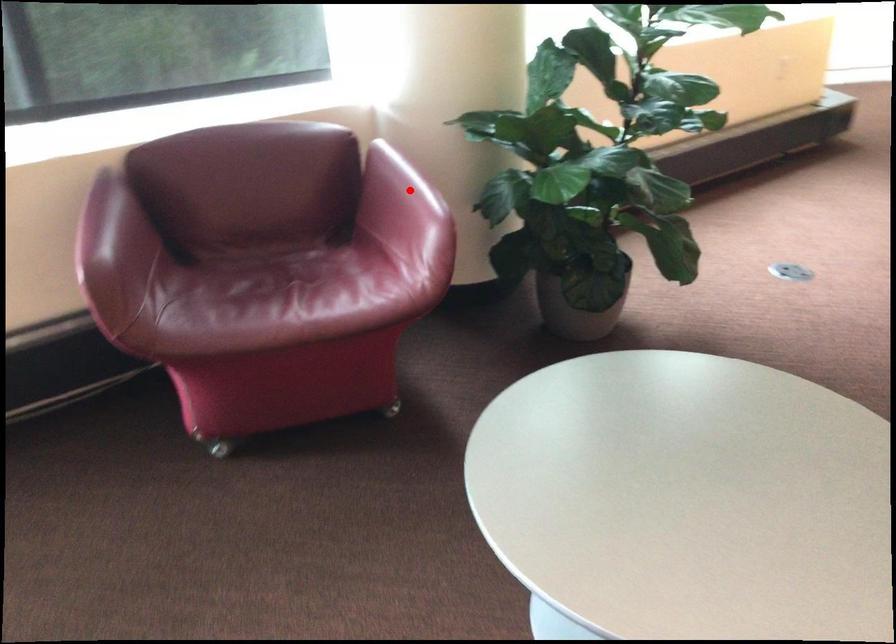
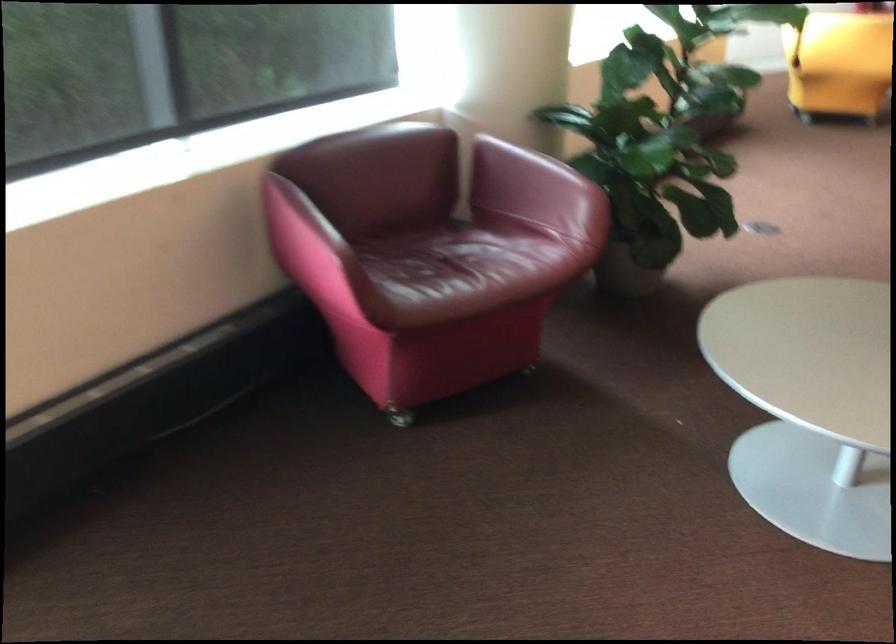
Question: I am providing you with two images of the same scene from different viewpoints. A red point is shown in image1. For the corresponding object point in image2, is it positioned nearer or farther from the camera?

Choices:
 (A) Nearer
 (B) Farther

Answer: (B)